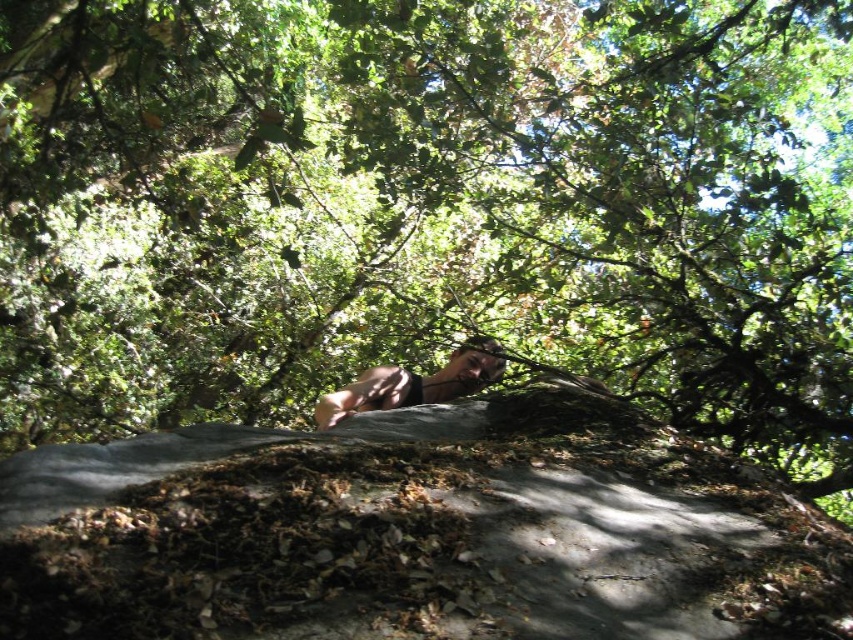
Question: Which of the following is the farthest from the observer?

Choices:
 (A) (621, 620)
 (B) (451, 368)

Answer: (B)

Question: Does gray rough boulder at center have a larger size compared to brown leather belt at center?

Choices:
 (A) no
 (B) yes

Answer: (B)

Question: Does gray rough boulder at center have a lesser width compared to brown leather belt at center?

Choices:
 (A) yes
 (B) no

Answer: (B)

Question: Which point is farther to the camera?

Choices:
 (A) brown leather belt at center
 (B) gray rough boulder at center

Answer: (A)

Question: Can you confirm if gray rough boulder at center is smaller than brown leather belt at center?

Choices:
 (A) yes
 (B) no

Answer: (B)